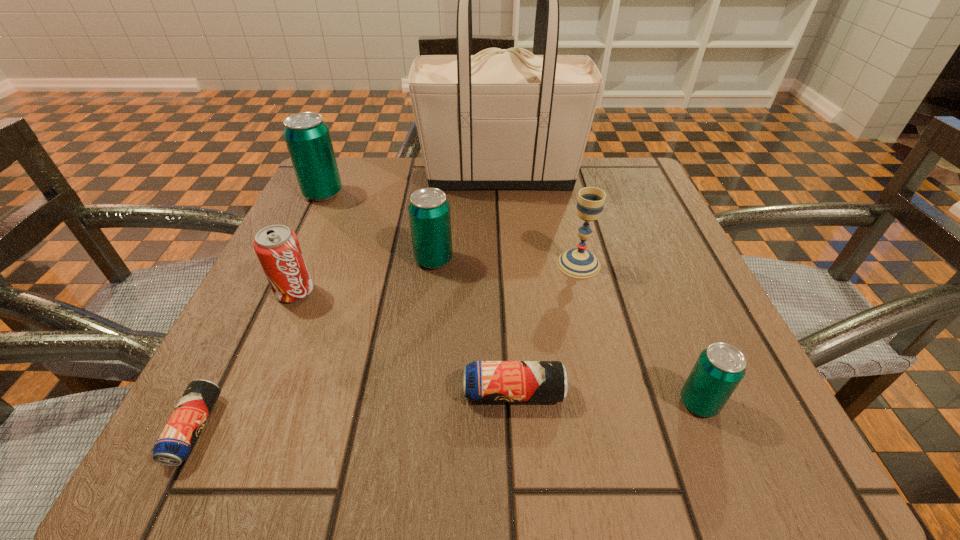
This screenshot has width=960, height=540. I want to click on gray shopping bag, so click(506, 119).

The width and height of the screenshot is (960, 540). In order to click on shopping bag in this screenshot , I will do `click(506, 119)`.

Identify the location of the biggest teal beer can. The height and width of the screenshot is (540, 960). coord(307,137).

This screenshot has width=960, height=540. What are the coordinates of `the tallest beer can` in the screenshot? It's located at (307, 137).

You are a GUI agent. You are given a task and a screenshot of the screen. Output one action in this format:
    pyautogui.click(x=<x>, y=<y>)
    Task: Click on the gray chalice
    The width and height of the screenshot is (960, 540).
    Given the screenshot: What is the action you would take?
    pyautogui.click(x=578, y=262)

Locate an element on the screen. Image resolution: width=960 pixels, height=540 pixels. the fourth nearest beer can is located at coordinates (429, 211).

In order to click on the second farthest teal beer can in this screenshot , I will do `click(429, 211)`.

At what (x,y) coordinates should I click in order to perform the action: click on the fourth nearest object. Please return your answer as a coordinate pair (x, y). This screenshot has width=960, height=540. Looking at the image, I should click on (277, 247).

Locate an element on the screen. The image size is (960, 540). pink soda can is located at coordinates (277, 247).

The image size is (960, 540). Identify the location of the third tallest beer can. (719, 369).